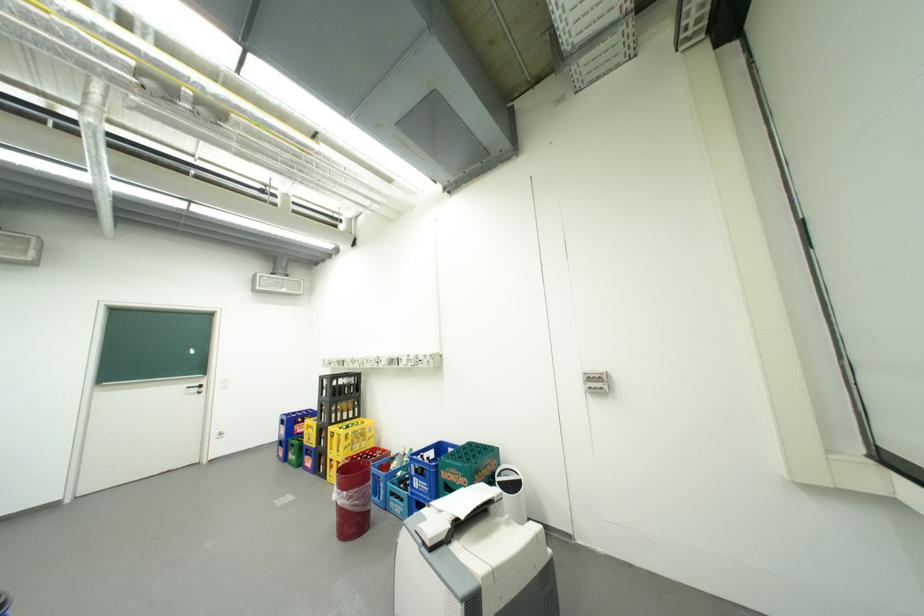
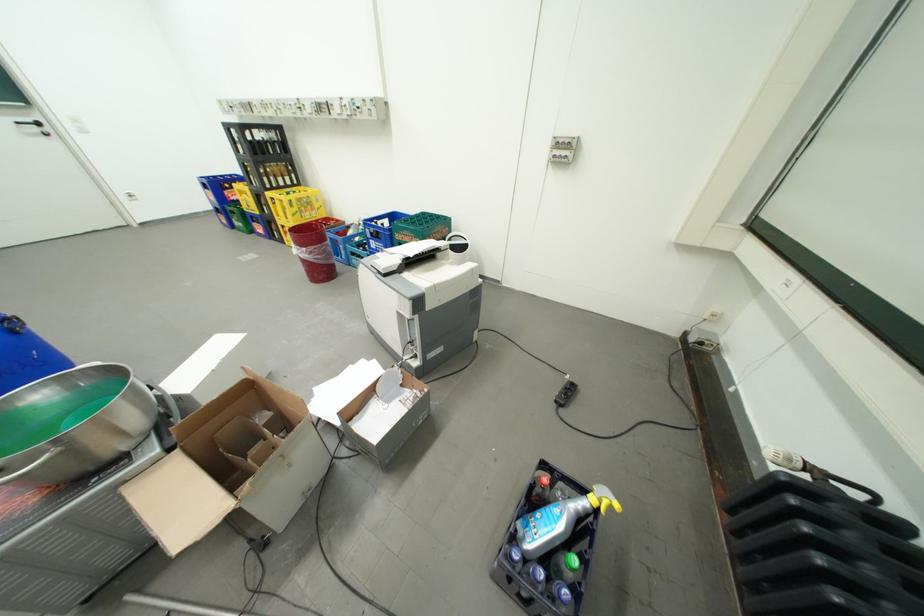
Where in the second image is the point corresponding to point (208, 386) from the first image?

(41, 122)